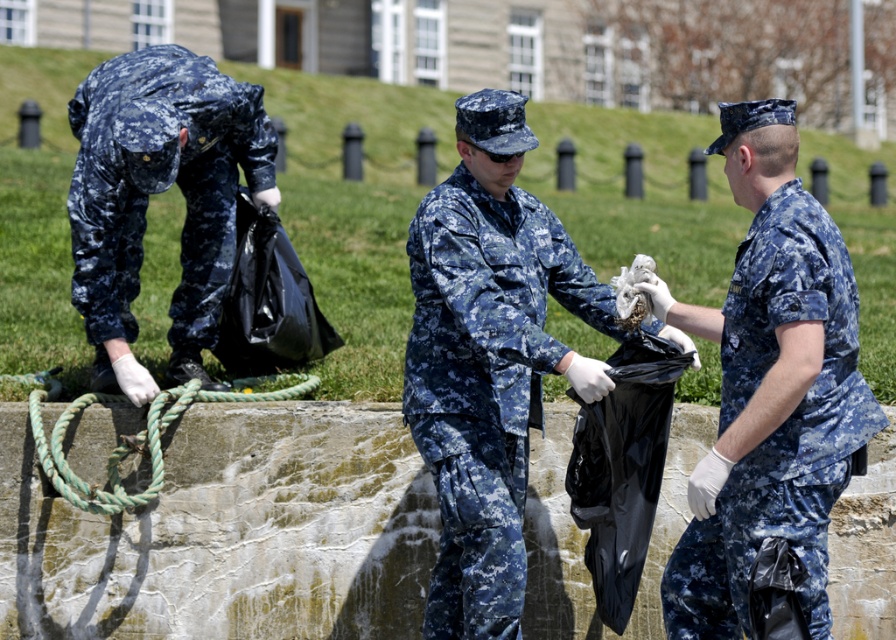
Question: Among these points, which one is farthest from the camera?

Choices:
 (A) (474, 330)
 (B) (764, 250)
 (C) (181, 323)
 (D) (39, 442)

Answer: (C)

Question: Which point is closer to the camera taking this photo?

Choices:
 (A) (148, 486)
 (B) (476, 406)
 (C) (97, 256)
 (D) (829, 394)

Answer: (D)

Question: Which of the following is the closest to the observer?

Choices:
 (A) (212, 230)
 (B) (470, 499)
 (C) (148, 449)
 (D) (734, 548)

Answer: (D)

Question: Is digital camouflage uniform at right closer to camera compared to green rough rope at center?

Choices:
 (A) yes
 (B) no

Answer: (A)

Question: Can you confirm if camouflage fabric uniform at center is wider than digital camouflage uniform at left?

Choices:
 (A) yes
 (B) no

Answer: (A)

Question: Is digital camouflage uniform at left to the left of digital camouflage uniform at right from the viewer's perspective?

Choices:
 (A) no
 (B) yes

Answer: (B)